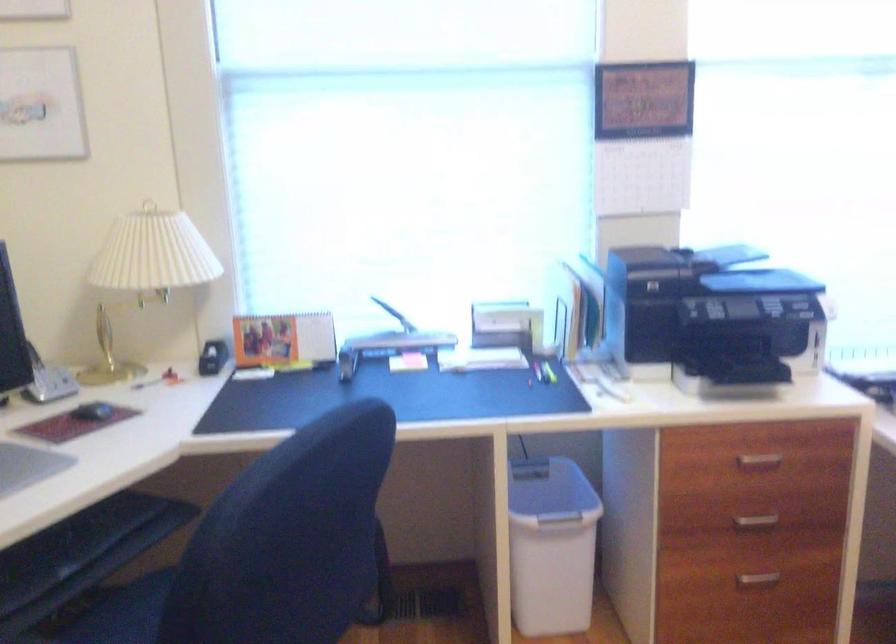
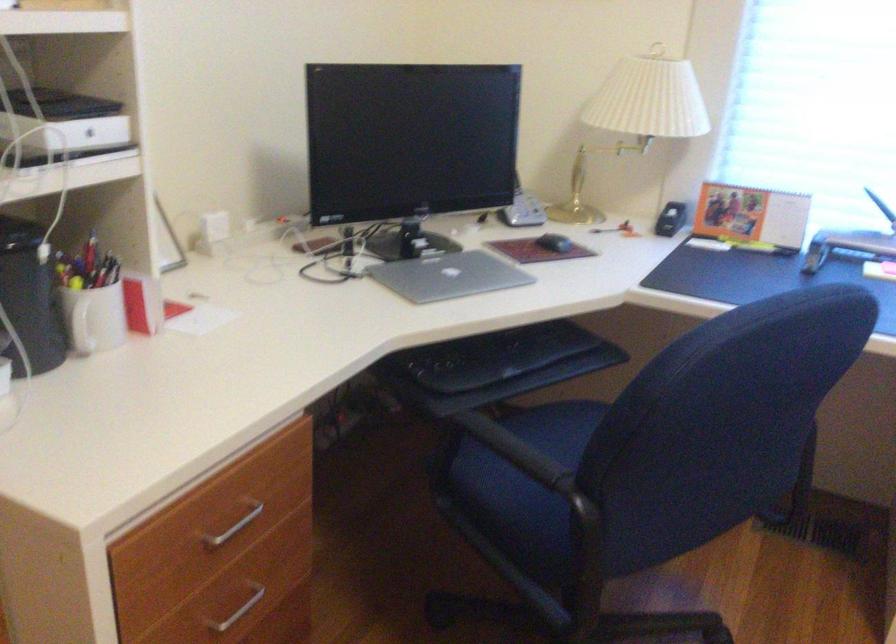
Find the pixel in the second image that matches point 371,350 in the first image.

(847, 245)